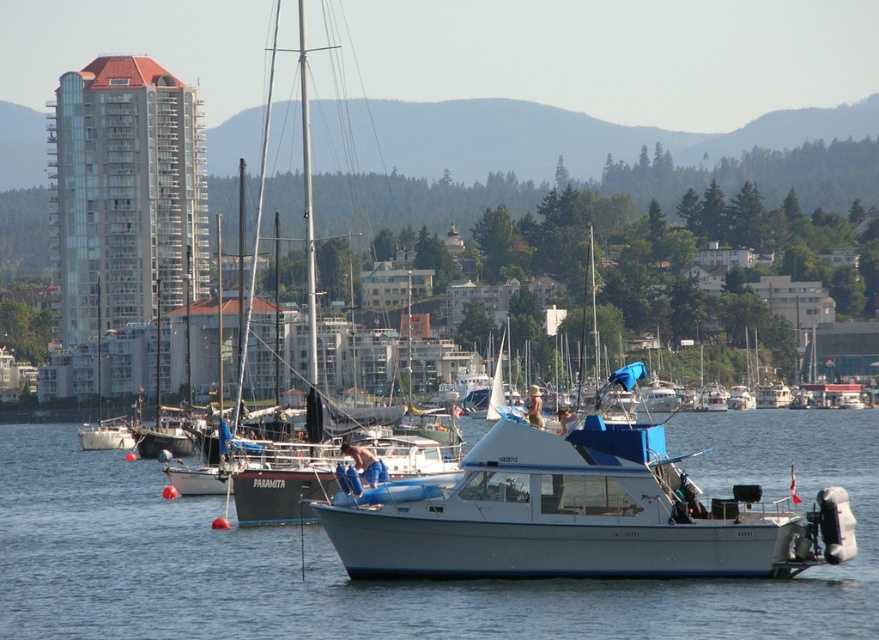
You are standing on the dock and see two points marked in the water. The first point is at coordinates point (28,454) and the second point is at point (307,173). Which point is closer to you?

Point (28,454) is closer to you because it is further to the viewer than point (307,173).